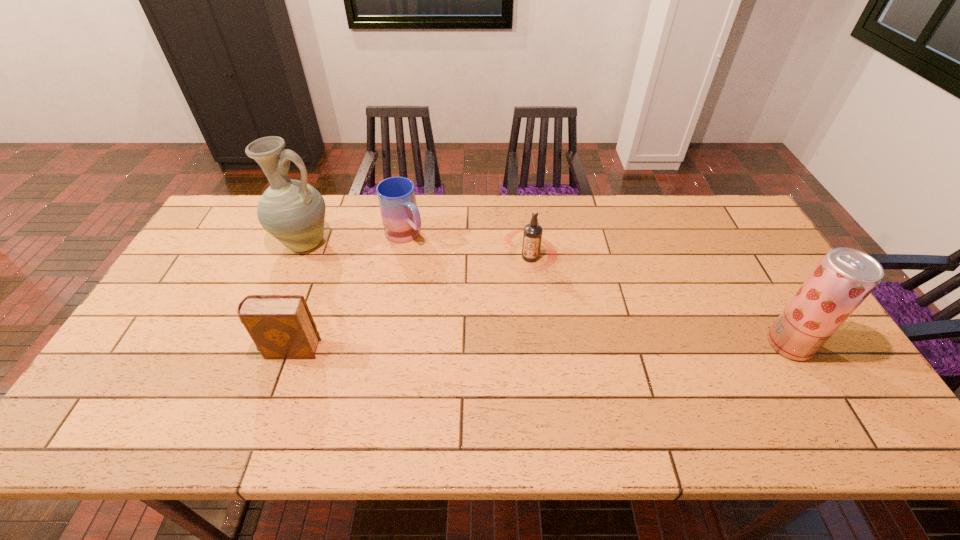
Locate an element on the screen. The image size is (960, 540). vacant space on the desktop that is between the diary and the second tallest object and is positioned on the side of the third object from left to right with the handle is located at coordinates (526, 347).

Identify the location of vacant spot on the desktop that is between the diary and the fruit juice and is positioned on the label of the fourth object from left to right. Image resolution: width=960 pixels, height=540 pixels. (476, 348).

In order to click on vacant space on the desktop that is between the diary and the rightmost object and is positioned on the handle side of the pitcher in this screenshot , I will do `click(470, 348)`.